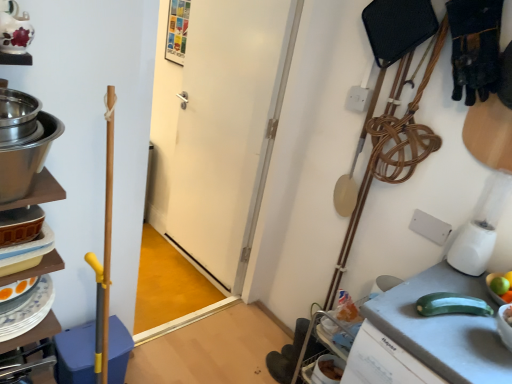
What do you see at coordinates (481, 227) in the screenshot?
I see `white plastic blender at right` at bounding box center [481, 227].

Identify the location of green matte apple at right. The image size is (512, 384). (494, 290).

From the image's perspective, is yellow smooth zucchini at right beneath white matte door at center?

Indeed, from the image's perspective, yellow smooth zucchini at right is shown beneath white matte door at center.

Looking at the image, does yellow smooth zucchini at right seem bigger or smaller compared to white matte door at center?

Considering their sizes, yellow smooth zucchini at right takes up less space than white matte door at center.

Which of these two, yellow smooth zucchini at right or white matte door at center, stands taller?

white matte door at center.

Is yellow smooth zucchini at right positioned with its back to white matte door at center?

yellow smooth zucchini at right is not turned away from white matte door at center.

Considering the sizes of objects stainless steel bowls at left and white plastic blender at right in the image provided, who is shorter, stainless steel bowls at left or white plastic blender at right?

With less height is stainless steel bowls at left.

Considering the positions of objects stainless steel bowls at left and white plastic blender at right in the image provided, who is more to the right, stainless steel bowls at left or white plastic blender at right?

white plastic blender at right is more to the right.

Looking at this image, from a real-world perspective, is stainless steel bowls at left positioned above or below white plastic blender at right?

Clearly, from a real-world perspective, stainless steel bowls at left is above white plastic blender at right.

Is white plastic blender at right not close to green matte zucchini at lower right?

white plastic blender at right is near green matte zucchini at lower right, not far away.

Does point (496, 208) come farther from viewer compared to point (478, 338)?

Yes, point (496, 208) is behind point (478, 338).

Between white plastic blender at right and green matte zucchini at lower right, which one has smaller size?

With smaller size is white plastic blender at right.

Is white plastic blender at right in front of green matte zucchini at lower right?

No, it is behind green matte zucchini at lower right.

Which of these two, green matte apple at right or green matte zucchini at lower right, stands shorter?

green matte apple at right.

How much distance is there between green matte apple at right and green matte zucchini at lower right?

green matte apple at right is 23.18 centimeters away from green matte zucchini at lower right.

Is green matte apple at right far away from green matte zucchini at lower right?

Actually, green matte apple at right and green matte zucchini at lower right are a little close together.

The width and height of the screenshot is (512, 384). I want to click on counter top below the green matte apple at right (from the image's perspective), so click(444, 328).

Who is bigger, green matte apple at right or white plastic blender at right?

white plastic blender at right is bigger.

Would you say green matte apple at right is outside white plastic blender at right?

Yes, green matte apple at right is not within white plastic blender at right.

Looking at this image, relative to white plastic blender at right, is green matte apple at right in front or behind?

In the image, green matte apple at right appears in front of white plastic blender at right.

Considering the relative positions of stainless steel bowls at left and green matte apple at right in the image provided, is stainless steel bowls at left to the right of green matte apple at right from the viewer's perspective?

In fact, stainless steel bowls at left is to the left of green matte apple at right.

From a real-world perspective, which is physically above, stainless steel bowls at left or green matte apple at right?

stainless steel bowls at left, from a real-world perspective.

From the image's perspective, is stainless steel bowls at left above or below green matte apple at right?

Based on their image positions, stainless steel bowls at left is located above green matte apple at right.

Which object is closer to the camera, green matte zucchini at lower right or stainless steel bowls at left?

stainless steel bowls at left.

Find the location of a particular element. appliance above the green matte zucchini at lower right (from a real-world perspective) is located at coordinates (23, 142).

Considering the relative sizes of green matte zucchini at lower right and stainless steel bowls at left in the image provided, is green matte zucchini at lower right thinner than stainless steel bowls at left?

No, green matte zucchini at lower right is not thinner than stainless steel bowls at left.

Would you say green matte zucchini at lower right contains stainless steel bowls at left?

No.

What are the coordinates of `food in front of the white matte door at center` in the screenshot? It's located at (508, 315).

At what (x,y) coordinates should I click in order to perform the action: click on blender lying on the right of stainless steel bowls at left. Please return your answer as a coordinate pair (x, y). Looking at the image, I should click on (481, 227).

In the scene shown: Looking at the image, which one is located further to stainless steel bowls at left, white matte door at center or white plastic blender at right?

The object further to stainless steel bowls at left is white matte door at center.

When comparing their distances from white matte door at center, does green matte zucchini at lower right or green matte apple at right seem closer?

green matte zucchini at lower right.

Looking at the image, which one is located closer to green matte zucchini at lower right, white matte door at center or yellow smooth zucchini at right?

yellow smooth zucchini at right is positioned closer to the anchor green matte zucchini at lower right.

Estimate the real-world distances between objects in this image. Which object is further from stainless steel bowls at left, green matte apple at right or green matte zucchini at lower right?

green matte apple at right lies further to stainless steel bowls at left than the other object.

Considering their positions, is white matte door at center positioned closer to green matte apple at right than yellow smooth zucchini at right?

yellow smooth zucchini at right lies closer to green matte apple at right than the other object.

From the image, which object appears to be nearer to yellow smooth zucchini at right, green matte zucchini at lower right or green matte apple at right?

green matte apple at right is closer to yellow smooth zucchini at right.

From the image, which object appears to be farther from white matte door at center, stainless steel bowls at left or green matte zucchini at lower right?

stainless steel bowls at left.

Which object lies further to the anchor point white plastic blender at right, green matte apple at right or green matte zucchini at lower right?

green matte zucchini at lower right.

Locate an element on the screen. The height and width of the screenshot is (384, 512). food between green matte apple at right and green matte zucchini at lower right vertically is located at coordinates (508, 315).

Where is `food between white matte door at center and green matte apple at right in the horizontal direction`? The image size is (512, 384). food between white matte door at center and green matte apple at right in the horizontal direction is located at coordinates (508, 315).

This screenshot has width=512, height=384. Identify the location of food located between white matte door at center and white plastic blender at right in the left-right direction. (508, 315).

Where is `fruit between stainless steel bowls at left and white plastic blender at right in the horizontal direction`? This screenshot has height=384, width=512. fruit between stainless steel bowls at left and white plastic blender at right in the horizontal direction is located at coordinates (494, 290).